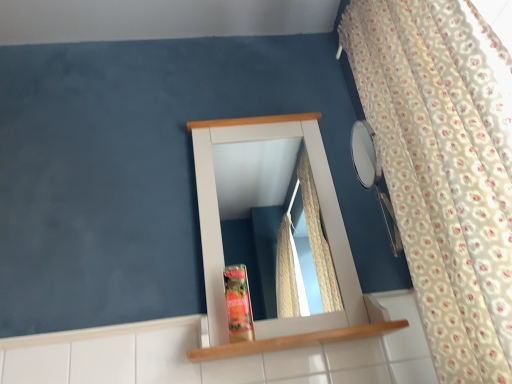
Question: Is matte plastic toiletry at center wider or thinner than wooden shelf at center?

Choices:
 (A) thin
 (B) wide

Answer: (A)

Question: From the image's perspective, relative to wooden shelf at center, is matte plastic toiletry at center above or below?

Choices:
 (A) above
 (B) below

Answer: (A)

Question: Estimate the real-world distances between objects in this image. Which object is closer to the white wood medicine cabinet at center?

Choices:
 (A) wooden shelf at center
 (B) white floral fabric curtain at right
 (C) white glossy mirror at center
 (D) matte plastic toiletry at center

Answer: (A)

Question: Which of these objects is positioned closest to the white glossy mirror at center?

Choices:
 (A) matte plastic toiletry at center
 (B) white wood medicine cabinet at center
 (C) white floral fabric curtain at right
 (D) wooden shelf at center

Answer: (B)